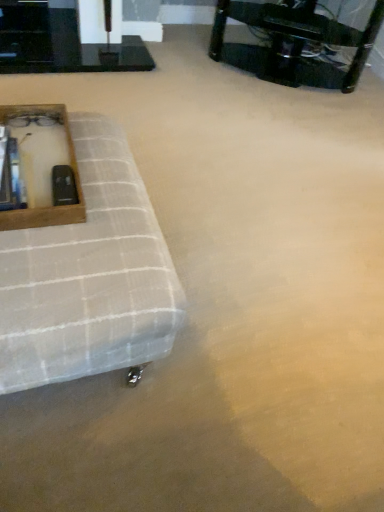
Question: Is white textured ottoman at left positioned with its back to black glossy table at upper left, the 2th table viewed from the right?

Choices:
 (A) yes
 (B) no

Answer: (B)

Question: Is white textured ottoman at left thinner than black glossy table at upper left, the 2th table viewed from the right?

Choices:
 (A) no
 (B) yes

Answer: (A)

Question: Is white textured ottoman at left shorter than black glossy table at upper left, the 2th table viewed from the right?

Choices:
 (A) yes
 (B) no

Answer: (B)

Question: Would you say white textured ottoman at left is a long distance from black glossy table at upper left, the 2th table viewed from the right?

Choices:
 (A) yes
 (B) no

Answer: (A)

Question: Is white textured ottoman at left wider than black glossy table at upper left, the first table when ordered from left to right?

Choices:
 (A) no
 (B) yes

Answer: (B)

Question: Looking at the image, does white textured ottoman at left seem bigger or smaller compared to black plastic table at upper right, positioned as the first table in right-to-left order?

Choices:
 (A) small
 (B) big

Answer: (A)

Question: From the image's perspective, is white textured ottoman at left positioned above or below black plastic table at upper right, positioned as the first table in right-to-left order?

Choices:
 (A) above
 (B) below

Answer: (B)

Question: From a real-world perspective, relative to black plastic table at upper right, positioned as the first table in right-to-left order, is white textured ottoman at left vertically above or below?

Choices:
 (A) above
 (B) below

Answer: (B)

Question: In the image, is white textured ottoman at left positioned in front of or behind black plastic table at upper right, positioned as the first table in right-to-left order?

Choices:
 (A) behind
 (B) front

Answer: (B)

Question: In terms of size, does black plastic table at upper right, acting as the second table starting from the left, appear bigger or smaller than wooden frame at left?

Choices:
 (A) small
 (B) big

Answer: (B)

Question: From the image's perspective, is black plastic table at upper right, acting as the second table starting from the left, above or below wooden frame at left?

Choices:
 (A) above
 (B) below

Answer: (A)

Question: Based on their positions, is black plastic table at upper right, acting as the second table starting from the left, located to the left or right of wooden frame at left?

Choices:
 (A) right
 (B) left

Answer: (A)

Question: From a real-world perspective, is black plastic table at upper right, positioned as the first table in right-to-left order, positioned above or below wooden frame at left?

Choices:
 (A) below
 (B) above

Answer: (A)

Question: Is black glossy table at upper left, the 2th table viewed from the right, taller or shorter than wooden frame at left?

Choices:
 (A) tall
 (B) short

Answer: (B)

Question: Looking at the image, does black glossy table at upper left, the first table when ordered from left to right, seem bigger or smaller compared to wooden frame at left?

Choices:
 (A) big
 (B) small

Answer: (A)